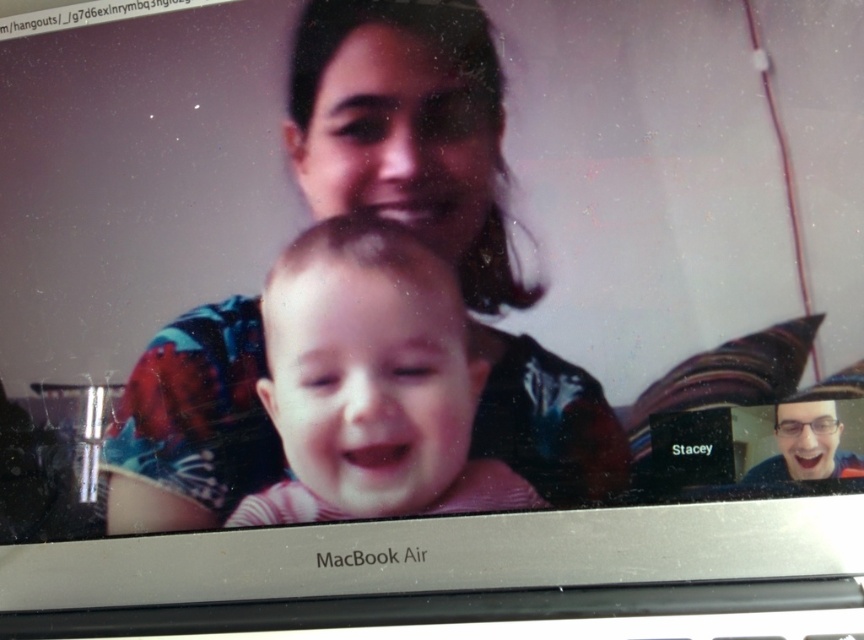
Question: Does matte black shirt at center appear on the right side of pink striped shirt at center?

Choices:
 (A) yes
 (B) no

Answer: (B)

Question: Based on their relative distances, which object is nearer to the glossy black glasses at upper right?

Choices:
 (A) matte black shirt at center
 (B) pink striped shirt at center

Answer: (B)

Question: Which point is closer to the camera?

Choices:
 (A) matte black shirt at center
 (B) pink striped shirt at center
 (C) glossy black glasses at upper right

Answer: (C)

Question: Which point is closer to the camera?

Choices:
 (A) glossy black glasses at upper right
 (B) matte black shirt at center
 (C) pink striped shirt at center

Answer: (A)

Question: Does matte black shirt at center appear on the left side of pink striped shirt at center?

Choices:
 (A) yes
 (B) no

Answer: (A)

Question: Is the position of matte black shirt at center less distant than that of pink striped shirt at center?

Choices:
 (A) no
 (B) yes

Answer: (B)